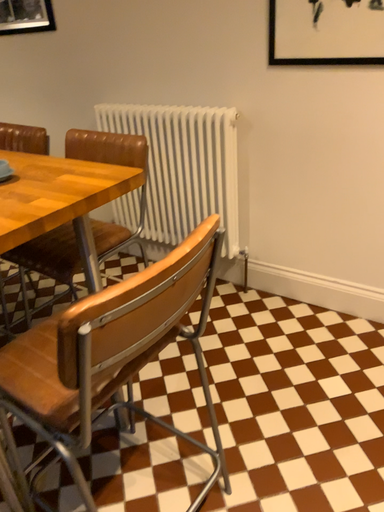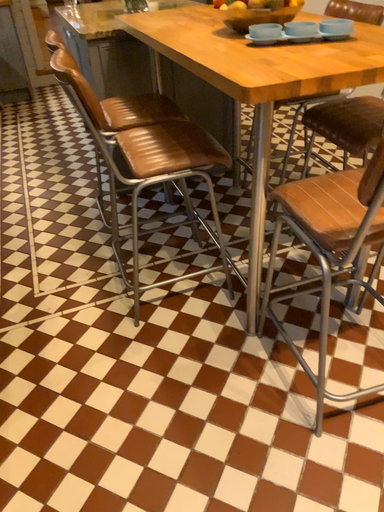
Question: How did the camera likely rotate when shooting the video?

Choices:
 (A) rotated left
 (B) rotated right

Answer: (A)